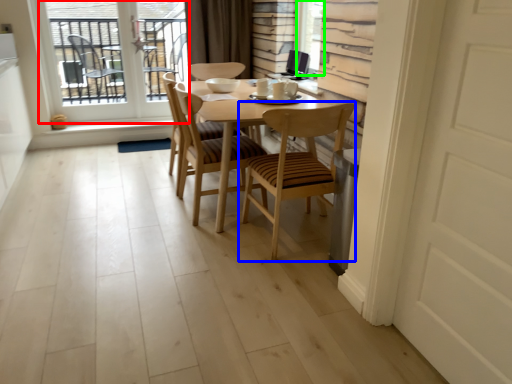
Question: Which object is positioned closest to window (highlighted by a red box)? Select from chair (highlighted by a blue box) and window screen (highlighted by a green box).

Choices:
 (A) chair
 (B) window screen

Answer: (B)